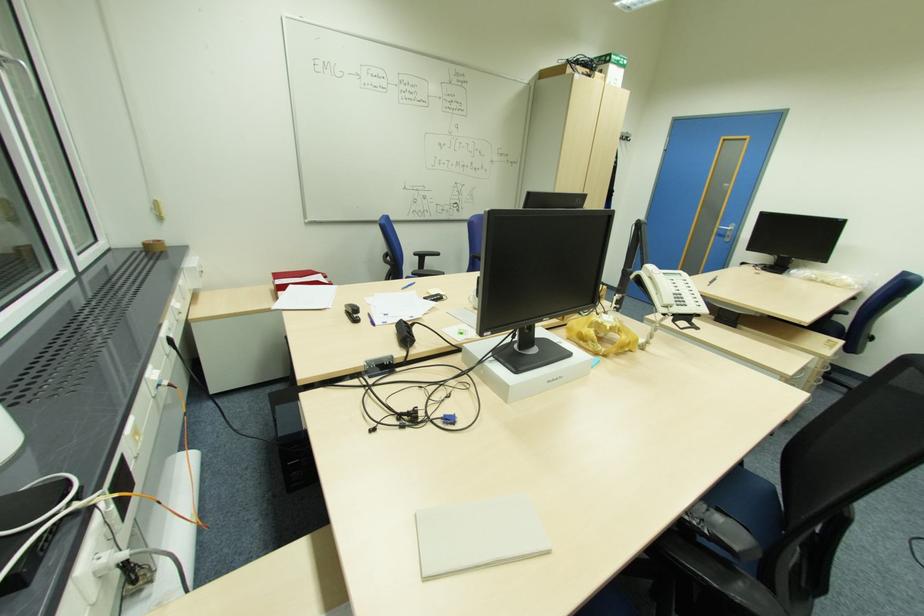
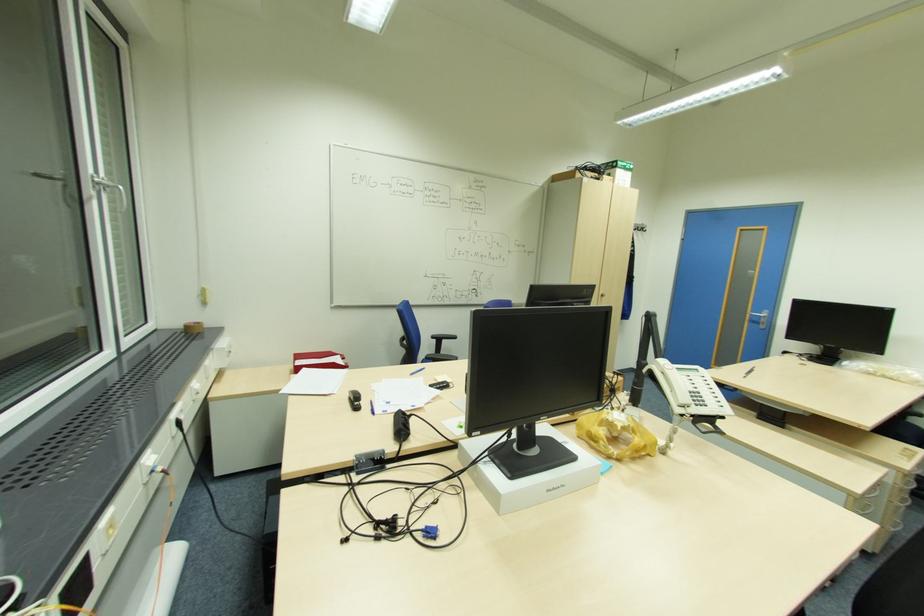
Find the pixel in the second image that matches point (732, 236) in the first image.

(766, 323)